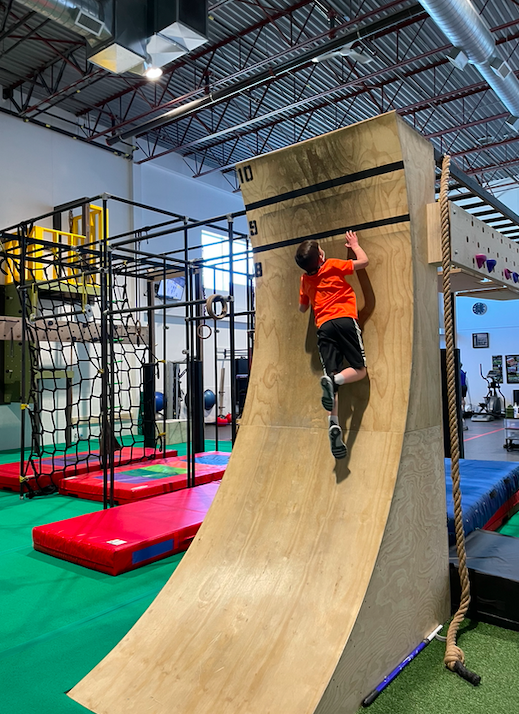
The height and width of the screenshot is (714, 519). I want to click on light, so click(x=154, y=73).